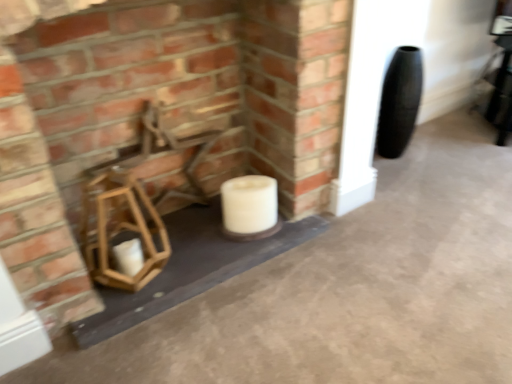
What do you see at coordinates (138, 201) in the screenshot? I see `wooden chair at center` at bounding box center [138, 201].

What is the approximate height of white matte candle at center?

The height of white matte candle at center is 8.45 inches.

The height and width of the screenshot is (384, 512). Find the location of `wooden chair at center`. wooden chair at center is located at coordinates (138, 201).

Does wooden lantern at lower left have a lesser width compared to wooden chair at center?

In fact, wooden lantern at lower left might be wider than wooden chair at center.

Is wooden lantern at lower left not near wooden chair at center?

No, there isn't a large distance between wooden lantern at lower left and wooden chair at center.

Is point (321, 148) farther from viewer compared to point (187, 172)?

That is False.

In the scene shown: From a real-world perspective, is wooden lantern at lower left physically above wooden chair at center?

Indeed, from a real-world perspective, wooden lantern at lower left stands above wooden chair at center.

How much distance is there between wooden chair at center and smooth concrete at center?

wooden chair at center and smooth concrete at center are 21.08 inches apart.

Does wooden chair at center appear on the left side of smooth concrete at center?

Indeed, wooden chair at center is positioned on the left side of smooth concrete at center.

Is wooden chair at center closer to camera compared to smooth concrete at center?

No, it is not.

From the image's perspective, which is below, wooden chair at center or smooth concrete at center?

From the image's view, smooth concrete at center is below.

Consider the image. Which is correct: smooth concrete at center is inside wooden chair at center, or outside of it?

smooth concrete at center exists outside the volume of wooden chair at center.

Could you tell me if smooth concrete at center is turned towards wooden chair at center?

No, smooth concrete at center is not turned towards wooden chair at center.

How far apart are smooth concrete at center and wooden chair at center?

The distance of smooth concrete at center from wooden chair at center is 21.08 inches.

Is smooth concrete at center with wooden chair at center?

No.

In the scene shown: Which object is thinner, white matte candle at center or wooden chair at center?

wooden chair at center.

Where is `chair above the white matte candle at center (from the image's perspective)`? Image resolution: width=512 pixels, height=384 pixels. chair above the white matte candle at center (from the image's perspective) is located at coordinates (138, 201).

Is white matte candle at center looking in the opposite direction of wooden chair at center?

Yes, white matte candle at center's orientation is away from wooden chair at center.

Considering the sizes of objects smooth concrete at center and wooden lantern at lower left in the image provided, who is wider, smooth concrete at center or wooden lantern at lower left?

smooth concrete at center is wider.

From the image's perspective, is smooth concrete at center below wooden lantern at lower left?

Correct, smooth concrete at center appears lower than wooden lantern at lower left in the image.

Is smooth concrete at center oriented away from wooden lantern at lower left?

No, smooth concrete at center is not facing away from wooden lantern at lower left.

Is white matte candle at center bigger than wooden lantern at lower left?

Incorrect, white matte candle at center is not larger than wooden lantern at lower left.

The image size is (512, 384). I want to click on toilet paper on the right side of wooden lantern at lower left, so click(249, 204).

Is white matte candle at center next to wooden lantern at lower left?

No, white matte candle at center is not beside wooden lantern at lower left.

Is white matte candle at center taller or shorter than wooden lantern at lower left?

Considering their sizes, white matte candle at center has less height than wooden lantern at lower left.

Is white matte candle at center turned away from smooth concrete at center?

white matte candle at center is not turned away from smooth concrete at center.

Which is in front, white matte candle at center or smooth concrete at center?

Positioned in front is smooth concrete at center.

Which is more to the left, white matte candle at center or smooth concrete at center?

white matte candle at center.

Is white matte candle at center situated inside smooth concrete at center or outside?

white matte candle at center is outside smooth concrete at center.

Identify the location of fireplace that appears on the right of wooden chair at center. The image size is (512, 384). (160, 116).

The width and height of the screenshot is (512, 384). What are the coordinates of `chair to the left of smooth concrete at center` in the screenshot? It's located at (138, 201).

Based on the photo, looking at the image, which one is located further to wooden lantern at lower left, wooden chair at center or white matte candle at center?

The object further to wooden lantern at lower left is white matte candle at center.

Which object lies nearer to the anchor point wooden chair at center, white matte candle at center or wooden lantern at lower left?

The object closer to wooden chair at center is wooden lantern at lower left.

Considering their positions, is wooden chair at center positioned further to smooth concrete at center than white matte candle at center?

wooden chair at center lies further to smooth concrete at center than the other object.

Based on their spatial positions, is smooth concrete at center or white matte candle at center closer to wooden chair at center?

Among the two, white matte candle at center is located nearer to wooden chair at center.

Considering their positions, is smooth concrete at center positioned further to white matte candle at center than wooden chair at center?

Among the two, smooth concrete at center is located further to white matte candle at center.

Which object lies nearer to the anchor point wooden lantern at lower left, white matte candle at center or wooden chair at center?

wooden chair at center is positioned closer to the anchor wooden lantern at lower left.

Looking at the image, which one is located closer to white matte candle at center, wooden chair at center or wooden lantern at lower left?

wooden chair at center.

Estimate the real-world distances between objects in this image. Which object is further from smooth concrete at center, wooden lantern at lower left or white matte candle at center?

The object further to smooth concrete at center is wooden lantern at lower left.

I want to click on toilet paper between wooden chair at center and smooth concrete at center in the horizontal direction, so click(x=249, y=204).

Where is `chair between wooden lantern at lower left and white matte candle at center in the front-back direction`? chair between wooden lantern at lower left and white matte candle at center in the front-back direction is located at coordinates (138, 201).

Image resolution: width=512 pixels, height=384 pixels. Find the location of `toilet paper situated between wooden lantern at lower left and smooth concrete at center from left to right`. toilet paper situated between wooden lantern at lower left and smooth concrete at center from left to right is located at coordinates (249, 204).

This screenshot has height=384, width=512. I want to click on fireplace situated between wooden chair at center and smooth concrete at center from left to right, so click(160, 116).